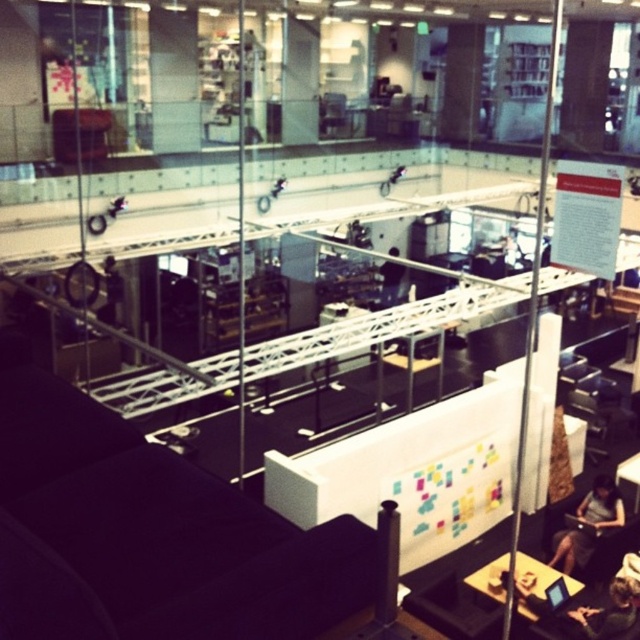
In the scene shown: You are standing at the balcony overlooking the office. You see a dark hair person at lower right and a black glossy tablet at lower right. Which object is wider from your viewpoint?

The dark hair person at lower right might be wider than black glossy tablet at lower right according to the description.

You are an office cleaner needing to navigate between the dark gray fabric person at lower right and the black glossy tablet at lower right. Can you pass through the space between them without moving either object?

The dark gray fabric person at lower right is wider than the black glossy tablet at lower right, so there might not be enough space to pass through the gap between them without moving at least one of the objects.

Consider the image. You are an office manager planning to rearrange the desks. You notice the dark gray fabric person at lower right and the black fabric person at center. Which person requires more desk space for their current setup?

The black fabric person at center requires more desk space because the dark gray fabric person at lower right occupies less space than them.